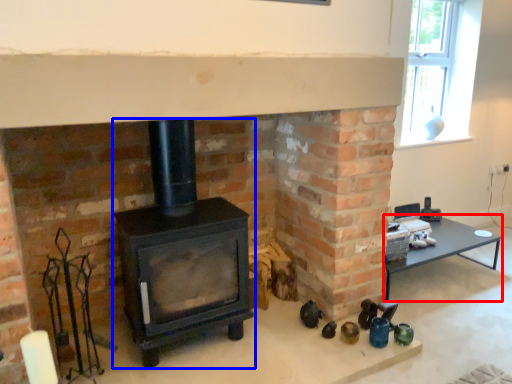
Question: Which object is further to the camera taking this photo, table (highlighted by a red box) or wood burning stove (highlighted by a blue box)?

Choices:
 (A) table
 (B) wood burning stove

Answer: (A)